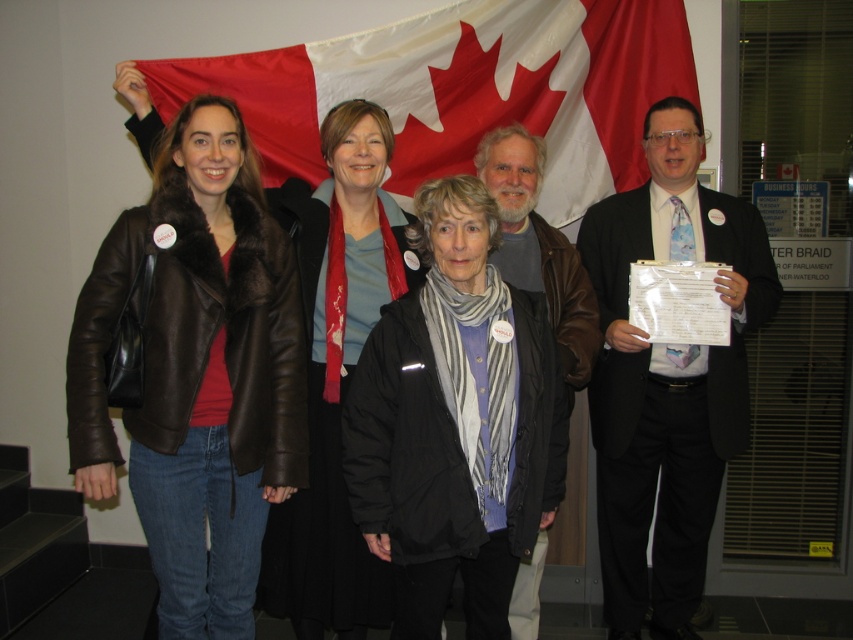
Question: Which of the following is the closest to the observer?

Choices:
 (A) (213, 596)
 (B) (302, 545)
 (C) (398, 44)
 (D) (485, 388)

Answer: (D)

Question: Which object appears farthest from the camera in this image?

Choices:
 (A) leather jacket at center
 (B) brown leather jacket at left
 (C) matte brown leather jacket at center
 (D) matte black suit at center

Answer: (D)

Question: From the image, what is the correct spatial relationship of brown leather jacket at left in relation to matte black suit at center?

Choices:
 (A) above
 (B) below

Answer: (A)

Question: Can you confirm if black woolen jacket at center is positioned to the right of leather jacket at center?

Choices:
 (A) no
 (B) yes

Answer: (A)

Question: Is brown leather jacket at left positioned behind matte black suit at center?

Choices:
 (A) no
 (B) yes

Answer: (A)

Question: Among these objects, which one is nearest to the camera?

Choices:
 (A) black woolen jacket at center
 (B) brown leather jacket at left
 (C) matte brown leather jacket at center

Answer: (A)